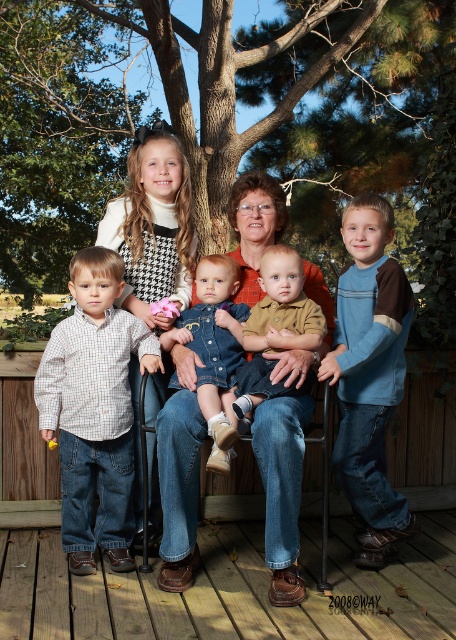
You are a photographer setting up a tripod to take a photo of the family. You notice the brown leather shoes at lower center and the checkered cotton shirt at left. Which object should you adjust your camera angle to focus on first if you want to capture both in the same frame without moving the tripod?

You should focus on the brown leather shoes at lower center first because it is shorter than the checkered cotton shirt at left, allowing you to adjust the camera angle to include both objects in the frame.

You are a photographer setting up for a family portrait. You need to position yourself so that the green leafy tree at upper center and the brown leather shoes at lower center are both in focus. Given that your camera has a depth of field range of 25 feet, will you be able to capture both subjects clearly in the same shot?

The green leafy tree at upper center is 28.35 feet away from the brown leather shoes at lower center. Since the distance between them exceeds the camera lens depth of field range of 25 feet, it would be challenging to have both in focus simultaneously. You may need to adjust your camera settings or position to ensure both are within the 25 feet range.